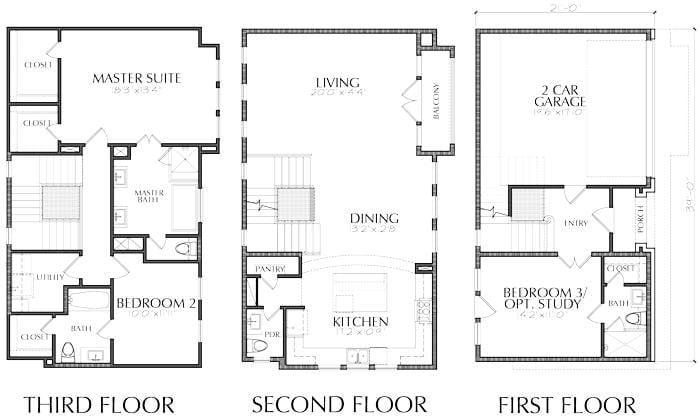
Find the location of `toilets`. toilets is located at coordinates (70, 353), (190, 250), (256, 343), (638, 316).